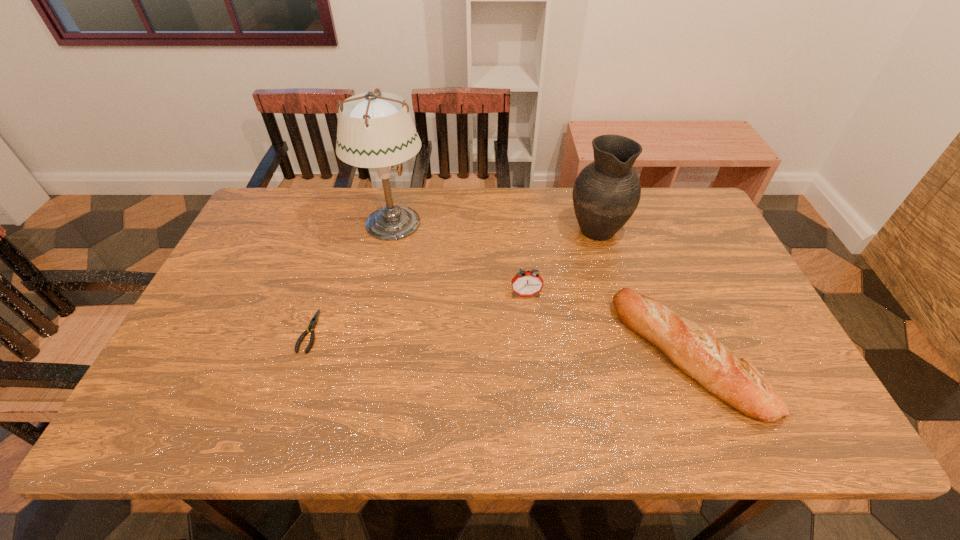
You are a GUI agent. You are given a task and a screenshot of the screen. Output one action in this format:
    pyautogui.click(x=<x>, y=<y>)
    Task: Click on the second object from left to right
    Image resolution: width=960 pixels, height=540 pixels.
    Given the screenshot: What is the action you would take?
    pyautogui.click(x=375, y=130)

Where is `lampshade`? The height and width of the screenshot is (540, 960). lampshade is located at coordinates (375, 130).

Locate an element on the screen. the second tallest object is located at coordinates (606, 193).

What are the coordinates of `alarm clock` in the screenshot? It's located at (525, 283).

This screenshot has width=960, height=540. Find the location of `baguet`. baguet is located at coordinates (690, 347).

Locate an element on the screen. This screenshot has width=960, height=540. the leftmost object is located at coordinates (314, 320).

Where is `the shortest object`? This screenshot has width=960, height=540. the shortest object is located at coordinates (314, 320).

Identify the location of free space located 0.210m on the lampshade of the lampshade. (494, 224).

Find the location of a particular element. free space located 0.070m on the side of the pitcher with the handle is located at coordinates (588, 196).

Identify the location of free space located on the side of the pitcher with the handle. (586, 189).